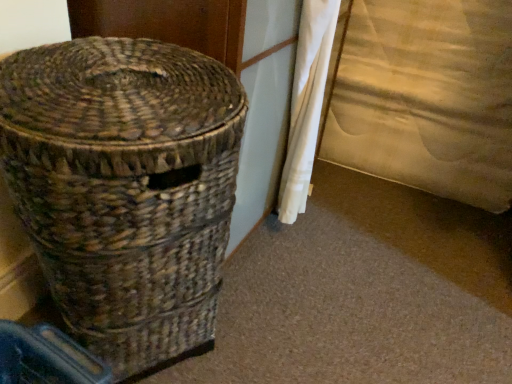
Measure the distance between woven brown basket at left and camera.

They are 52.97 centimeters apart.

The height and width of the screenshot is (384, 512). What do you see at coordinates (125, 187) in the screenshot?
I see `woven brown basket at left` at bounding box center [125, 187].

Where is `woven brown basket at left`? This screenshot has height=384, width=512. woven brown basket at left is located at coordinates (125, 187).

This screenshot has width=512, height=384. What are the coordinates of `woven brown basket at left` in the screenshot? It's located at (125, 187).